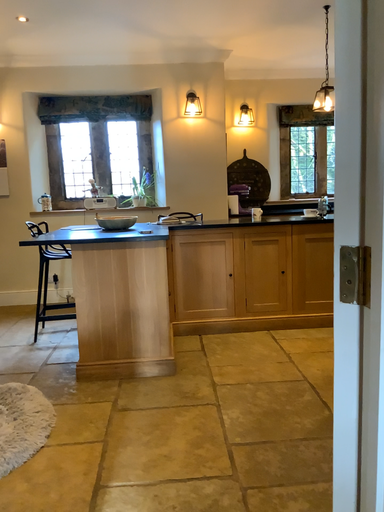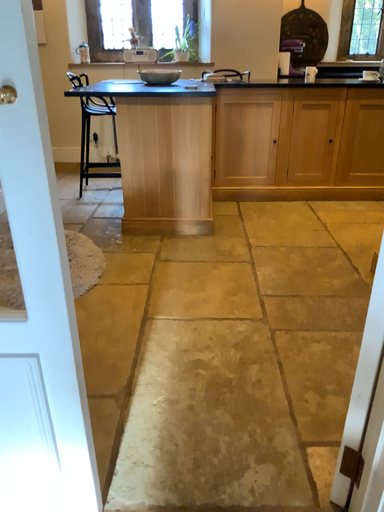
Question: Which way did the camera rotate in the video?

Choices:
 (A) rotated upward
 (B) rotated downward

Answer: (B)